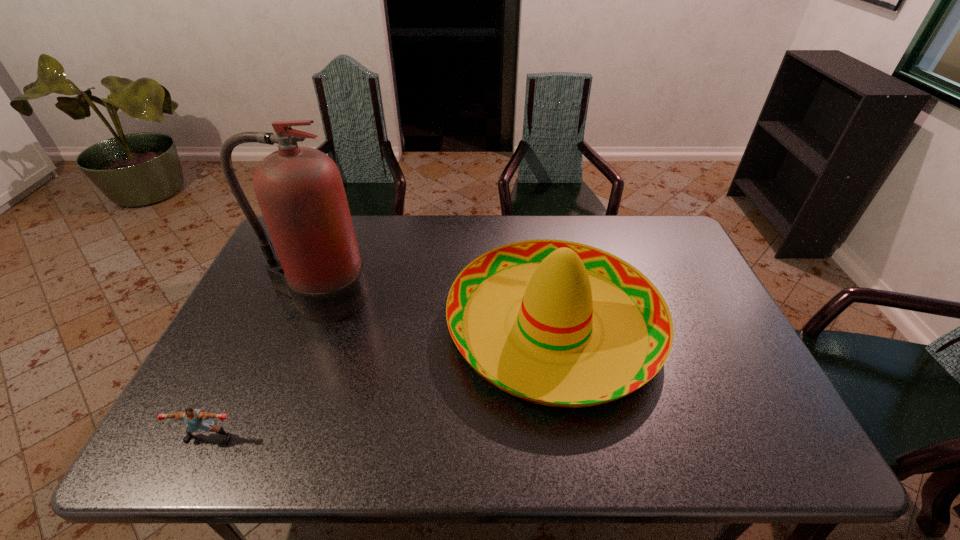
What are the coordinates of `object that is at the near left corner` in the screenshot? It's located at (196, 419).

Image resolution: width=960 pixels, height=540 pixels. I want to click on free space at the far edge, so 605,234.

In the image, there is a desktop. At what (x,y) coordinates should I click in order to perform the action: click on vacant space at the near edge. Please return your answer as a coordinate pair (x, y). Looking at the image, I should click on (556, 432).

You are a GUI agent. You are given a task and a screenshot of the screen. Output one action in this format:
    pyautogui.click(x=<x>, y=<y>)
    Task: Click on the free point at the left edge
    This screenshot has width=960, height=540.
    Given the screenshot: What is the action you would take?
    point(252,287)

You are a GUI agent. You are given a task and a screenshot of the screen. Output one action in this format:
    pyautogui.click(x=<x>, y=<y>)
    Task: Click on the vacant region at the right edge of the desktop
    
    Given the screenshot: What is the action you would take?
    pyautogui.click(x=697, y=264)

The image size is (960, 540). In order to click on vacant space at the far right corner in this screenshot , I will do [656, 222].

In the image, there is a desktop. At what (x,y) coordinates should I click in order to perform the action: click on blank space at the near right corner. Please return your answer as a coordinate pair (x, y). This screenshot has width=960, height=540. Looking at the image, I should click on (732, 446).

Find the location of a particular element. The width and height of the screenshot is (960, 540). free spot between the nearest object and the tallest object is located at coordinates (263, 367).

In order to click on unoccupied area between the tallest object and the shortest object in this screenshot , I will do `click(263, 367)`.

Where is `blank region between the fire extinguisher and the nearest object`? The image size is (960, 540). blank region between the fire extinguisher and the nearest object is located at coordinates (263, 367).